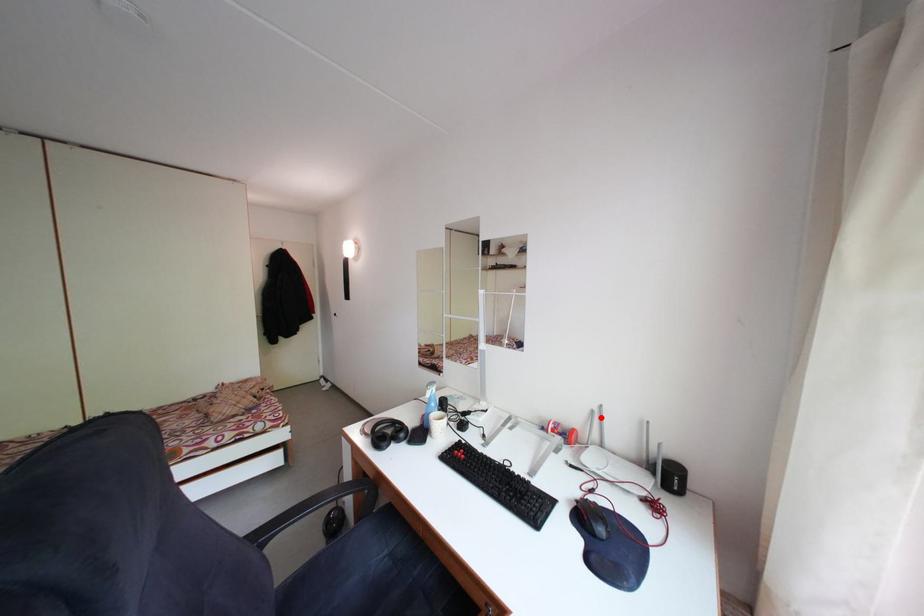
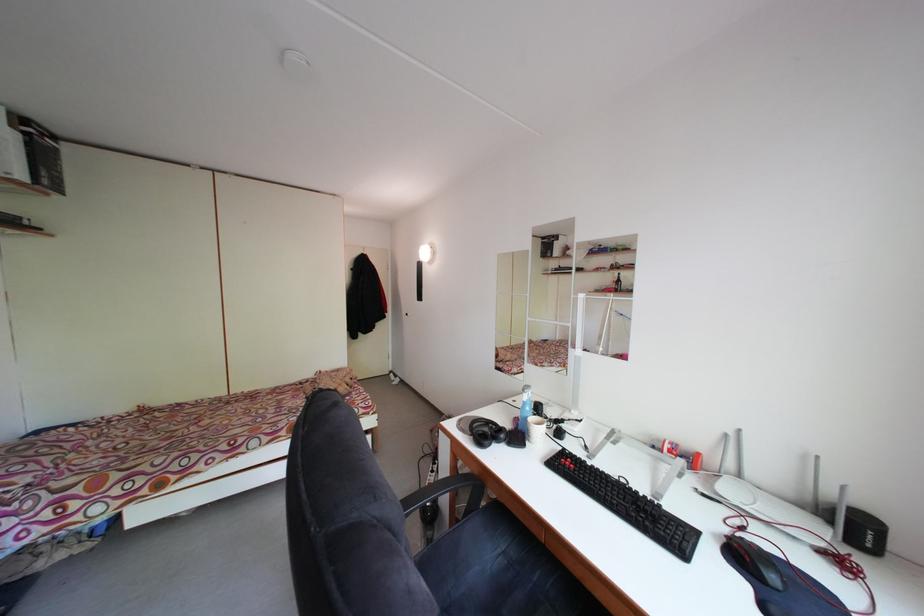
In the second image, find the point that corresponds to the highlighted location in the first image.

(735, 442)